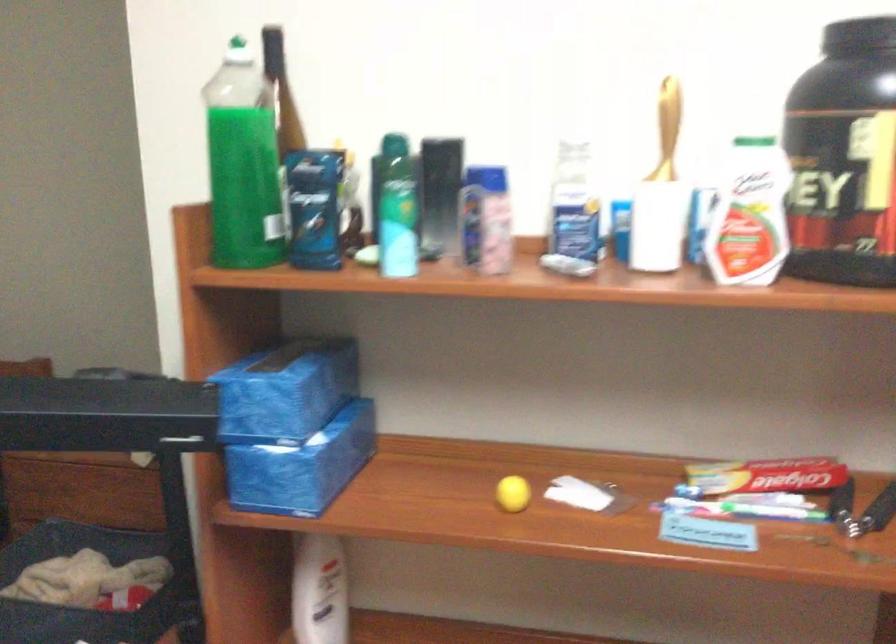
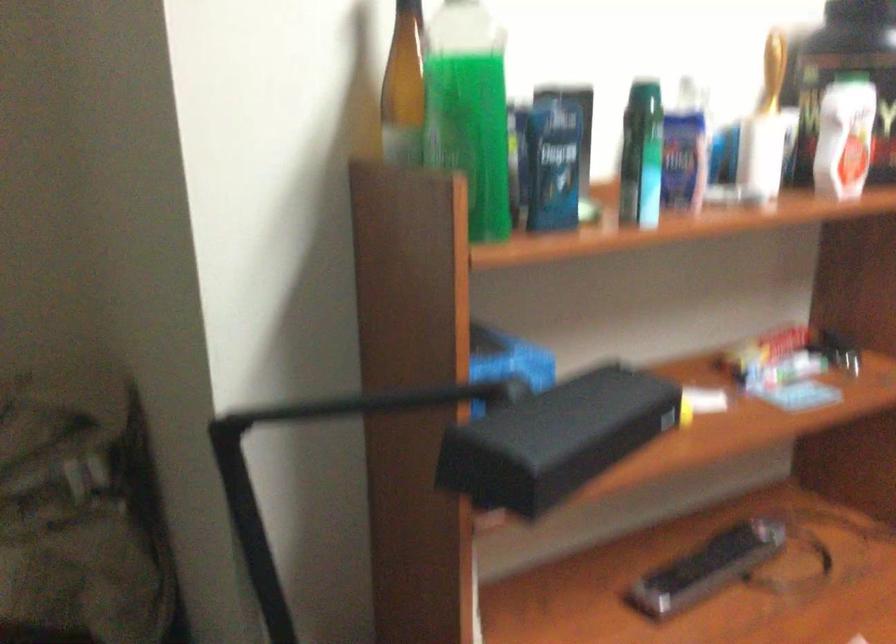
Question: The camera is either moving clockwise (left) or counter-clockwise (right) around the object. The first image is from the beginning of the video and the second image is from the end. Is the camera moving left or right when shooting the video?

Choices:
 (A) Left
 (B) Right

Answer: (A)